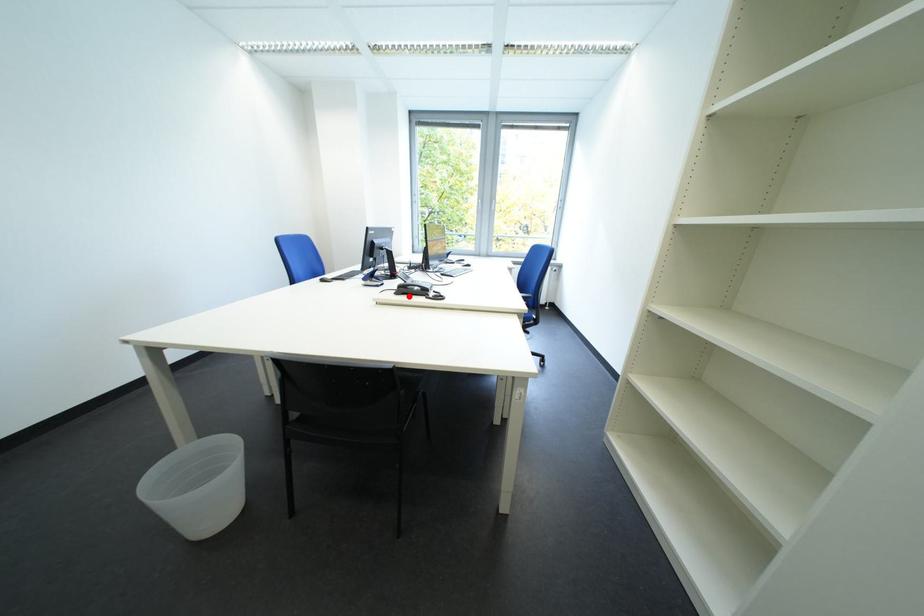
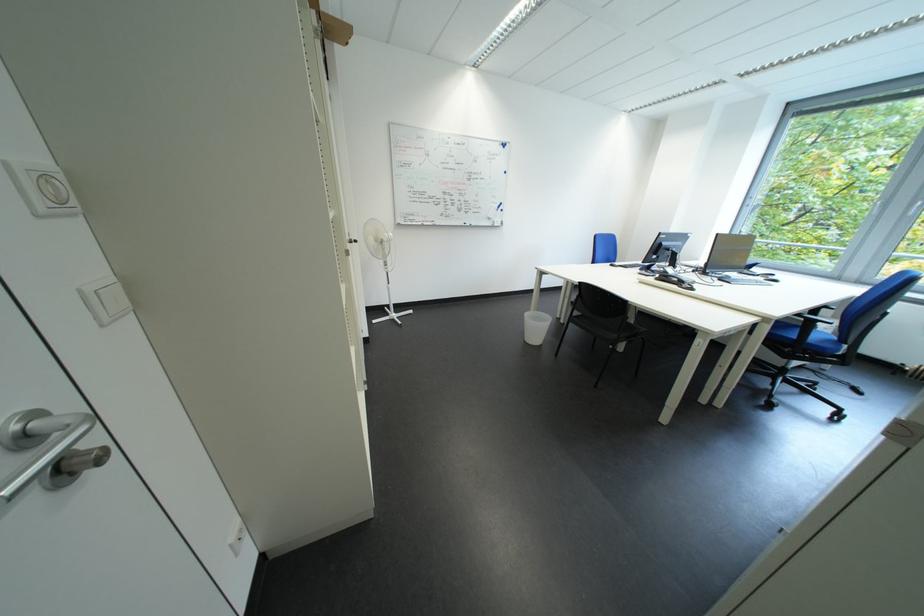
Question: A red point is marked in image1. In image2, is the corresponding 3D point closer to the camera or farther? Reply with the corresponding letter.

Choices:
 (A) The corresponding 3D point is closer.
 (B) The corresponding 3D point is farther.

Answer: (A)